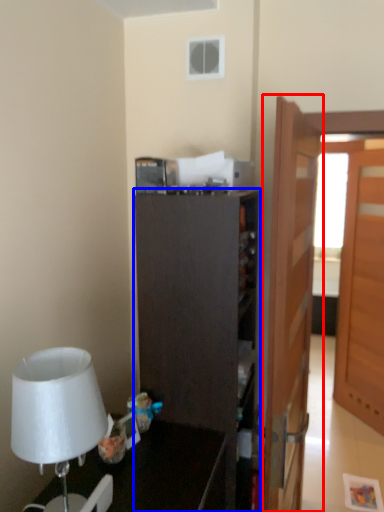
Question: Among these objects, which one is nearest to the camera, door (highlighted by a red box) or cabinetry (highlighted by a blue box)?

Choices:
 (A) door
 (B) cabinetry

Answer: (A)